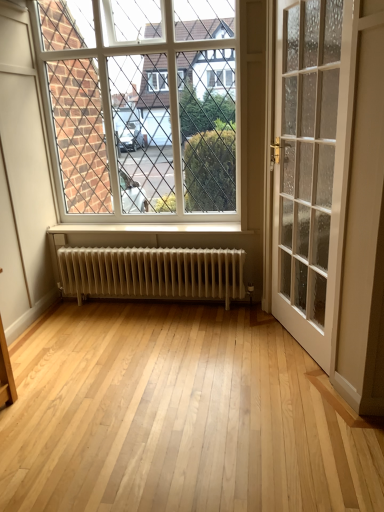
Locate an element on the screen. The height and width of the screenshot is (512, 384). free space between white glass door at right and white metallic radiator at center is located at coordinates (229, 339).